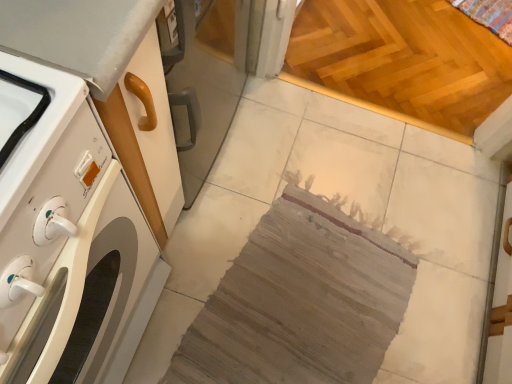
Measure the distance between light brown wooden floor at upper right and camera.

The distance of light brown wooden floor at upper right from camera is 4.78 feet.

The height and width of the screenshot is (384, 512). What do you see at coordinates (403, 60) in the screenshot?
I see `light brown wooden floor at upper right` at bounding box center [403, 60].

Locate an element on the screen. The height and width of the screenshot is (384, 512). woven fabric rug at center is located at coordinates (300, 302).

Considering the positions of objects white glossy washing machine at left and woven fabric rug at center in the image provided, who is behind, white glossy washing machine at left or woven fabric rug at center?

woven fabric rug at center is further away from the camera.

Could you tell me if white glossy washing machine at left is turned towards woven fabric rug at center?

Yes.

Does point (60, 163) come in front of point (194, 324)?

Yes.

Based on the photo, how far apart are white glossy washing machine at left and woven fabric rug at center?

white glossy washing machine at left and woven fabric rug at center are 21.07 inches apart from each other.

Considering the relative sizes of woven fabric rug at center and light brown wooden floor at upper right in the image provided, is woven fabric rug at center bigger than light brown wooden floor at upper right?

Incorrect, woven fabric rug at center is not larger than light brown wooden floor at upper right.

From a real-world perspective, is woven fabric rug at center above or below light brown wooden floor at upper right?

woven fabric rug at center is situated higher than light brown wooden floor at upper right in the real world.

Can you confirm if woven fabric rug at center is taller than light brown wooden floor at upper right?

Incorrect, the height of woven fabric rug at center is not larger of that of light brown wooden floor at upper right.

Between point (239, 298) and point (324, 48), which one is positioned behind?

The point (324, 48) is more distant.

Is light brown wooden floor at upper right to the left of woven fabric rug at center from the viewer's perspective?

In fact, light brown wooden floor at upper right is to the right of woven fabric rug at center.

Is light brown wooden floor at upper right in front of or behind woven fabric rug at center in the image?

light brown wooden floor at upper right is behind woven fabric rug at center.

Measure the distance from light brown wooden floor at upper right to woven fabric rug at center.

light brown wooden floor at upper right is 28.21 inches away from woven fabric rug at center.

Considering the relative sizes of white glossy washing machine at left and light brown wooden floor at upper right in the image provided, is white glossy washing machine at left smaller than light brown wooden floor at upper right?

No, white glossy washing machine at left is not smaller than light brown wooden floor at upper right.

From a real-world perspective, who is located lower, white glossy washing machine at left or light brown wooden floor at upper right?

From a 3D spatial view, light brown wooden floor at upper right is below.

Between white glossy washing machine at left and light brown wooden floor at upper right, which one is positioned in front?

white glossy washing machine at left is more forward.

Is white glossy washing machine at left placed right next to light brown wooden floor at upper right?

No, white glossy washing machine at left is not touching light brown wooden floor at upper right.

Can you see woven fabric rug at center touching white glossy washing machine at left?

No, woven fabric rug at center is not next to white glossy washing machine at left.

From a real-world perspective, between woven fabric rug at center and white glossy washing machine at left, who is vertically lower?

From a 3D spatial view, woven fabric rug at center is below.

Considering the relative positions of woven fabric rug at center and white glossy washing machine at left in the image provided, is woven fabric rug at center to the left or to the right of white glossy washing machine at left?

From the image, it's evident that woven fabric rug at center is to the right of white glossy washing machine at left.

Between woven fabric rug at center and white glossy washing machine at left, which one has more height?

white glossy washing machine at left is taller.

From a real-world perspective, is light brown wooden floor at upper right physically above white glossy washing machine at left?

No, from a real-world perspective, light brown wooden floor at upper right is not over white glossy washing machine at left

Is white glossy washing machine at left a part of light brown wooden floor at upper right?

No, light brown wooden floor at upper right does not contain white glossy washing machine at left.

Where is `plywood located on the right of white glossy washing machine at left`? plywood located on the right of white glossy washing machine at left is located at coordinates (403, 60).

Does light brown wooden floor at upper right lie in front of white glossy washing machine at left?

No, light brown wooden floor at upper right is further to the viewer.

Locate an element on the screen. The image size is (512, 384). blanket that is under the white glossy washing machine at left (from a real-world perspective) is located at coordinates point(300,302).

Locate an element on the screen. blanket above the light brown wooden floor at upper right (from a real-world perspective) is located at coordinates (300, 302).

Based on their spatial positions, is light brown wooden floor at upper right or woven fabric rug at center closer to white glossy washing machine at left?

woven fabric rug at center is positioned closer to the anchor white glossy washing machine at left.

Estimate the real-world distances between objects in this image. Which object is further from light brown wooden floor at upper right, woven fabric rug at center or white glossy washing machine at left?

The object further to light brown wooden floor at upper right is white glossy washing machine at left.

Looking at the image, which one is located further to white glossy washing machine at left, woven fabric rug at center or light brown wooden floor at upper right?

Based on the image, light brown wooden floor at upper right appears to be further to white glossy washing machine at left.

When comparing their distances from light brown wooden floor at upper right, does white glossy washing machine at left or woven fabric rug at center seem closer?

The object closer to light brown wooden floor at upper right is woven fabric rug at center.

Looking at the image, which one is located closer to woven fabric rug at center, white glossy washing machine at left or light brown wooden floor at upper right?

Based on the image, white glossy washing machine at left appears to be nearer to woven fabric rug at center.

Looking at the image, which one is located further to woven fabric rug at center, light brown wooden floor at upper right or white glossy washing machine at left?

Among the two, light brown wooden floor at upper right is located further to woven fabric rug at center.

You are a GUI agent. You are given a task and a screenshot of the screen. Output one action in this format:
    pyautogui.click(x=<x>, y=<y>)
    Task: Click on the blanket between white glossy washing machine at left and light brown wooden floor at upper right along the z-axis
    The image size is (512, 384).
    Given the screenshot: What is the action you would take?
    pyautogui.click(x=300, y=302)